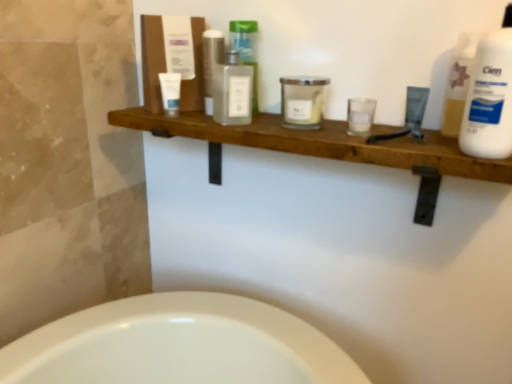
Question: From the image's perspective, would you say translucent glass bottle at center, the 3th toiletry in the left-to-right sequence, is shown under white plastic bottle at upper right?

Choices:
 (A) yes
 (B) no

Answer: (B)

Question: Is translucent glass bottle at center, the 3th toiletry in the left-to-right sequence, placed right next to white plastic bottle at upper right?

Choices:
 (A) yes
 (B) no

Answer: (B)

Question: Would you say translucent glass bottle at center, arranged as the fourth toiletry when viewed from the right, contains white plastic bottle at upper right?

Choices:
 (A) no
 (B) yes

Answer: (A)

Question: Does translucent glass bottle at center, arranged as the fourth toiletry when viewed from the right, come behind white plastic bottle at upper right?

Choices:
 (A) no
 (B) yes

Answer: (B)

Question: Are translucent glass bottle at center, arranged as the fourth toiletry when viewed from the right, and white plastic bottle at upper right far apart?

Choices:
 (A) no
 (B) yes

Answer: (A)

Question: Based on their positions, is white plastic bottle at upper right located to the left or right of matte black tube at upper right, the 6th toiletry from the left?

Choices:
 (A) right
 (B) left

Answer: (A)

Question: Looking at the image, does white plastic bottle at upper right seem bigger or smaller compared to matte black tube at upper right, the 6th toiletry from the left?

Choices:
 (A) big
 (B) small

Answer: (A)

Question: In terms of height, does white plastic bottle at upper right look taller or shorter compared to matte black tube at upper right, which is the first toiletry from right to left?

Choices:
 (A) short
 (B) tall

Answer: (B)

Question: Which is correct: white plastic bottle at upper right is inside matte black tube at upper right, the 6th toiletry from the left, or outside of it?

Choices:
 (A) inside
 (B) outside

Answer: (B)

Question: Is matte black tube at upper right, the 6th toiletry from the left, in front of or behind translucent glass bottle at center, arranged as the fourth toiletry when viewed from the right, in the image?

Choices:
 (A) front
 (B) behind

Answer: (A)

Question: Do you think matte black tube at upper right, which is the first toiletry from right to left, is within translucent glass bottle at center, arranged as the fourth toiletry when viewed from the right, or outside of it?

Choices:
 (A) outside
 (B) inside

Answer: (A)

Question: From the image's perspective, is matte black tube at upper right, which is the first toiletry from right to left, above or below translucent glass bottle at center, arranged as the fourth toiletry when viewed from the right?

Choices:
 (A) below
 (B) above

Answer: (A)

Question: Considering the positions of matte black tube at upper right, which is the first toiletry from right to left, and translucent glass bottle at center, the 3th toiletry in the left-to-right sequence, in the image, is matte black tube at upper right, which is the first toiletry from right to left, bigger or smaller than translucent glass bottle at center, the 3th toiletry in the left-to-right sequence,?

Choices:
 (A) big
 (B) small

Answer: (B)

Question: Considering the positions of matte black tube at upper right, which is the first toiletry from right to left, and clear glass candle at center, the second toiletry when ordered from right to left, in the image, is matte black tube at upper right, which is the first toiletry from right to left, bigger or smaller than clear glass candle at center, the second toiletry when ordered from right to left,?

Choices:
 (A) big
 (B) small

Answer: (B)

Question: Relative to clear glass candle at center, the second toiletry when ordered from right to left, is matte black tube at upper right, which is the first toiletry from right to left, in front or behind?

Choices:
 (A) behind
 (B) front

Answer: (A)